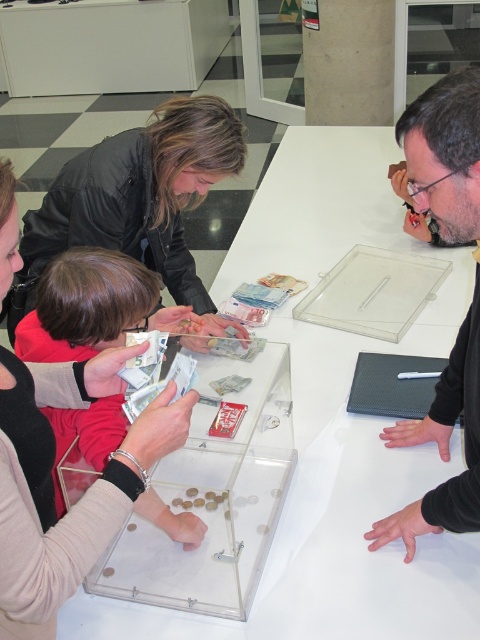
Question: Which point appears farthest from the camera in this image?

Choices:
 (A) (134, 266)
 (B) (256, 461)

Answer: (B)

Question: Estimate the real-world distances between objects in this image. Which object is closer to the red fabric child at lower left?

Choices:
 (A) transparent plastic table at center
 (B) matte black jacket at upper left

Answer: (B)

Question: Which object is farther from the camera taking this photo?

Choices:
 (A) black matte laptop at upper right
 (B) transparent plastic table at center
 (C) red fabric child at lower left
 (D) matte black jacket at upper left

Answer: (D)

Question: Is transparent plastic table at center wider than matte black jacket at upper left?

Choices:
 (A) no
 (B) yes

Answer: (B)

Question: Can you confirm if transparent acrylic box at center is bigger than red fabric child at lower left?

Choices:
 (A) no
 (B) yes

Answer: (B)

Question: Does transparent plastic table at center have a greater width compared to matte black jacket at upper left?

Choices:
 (A) no
 (B) yes

Answer: (B)